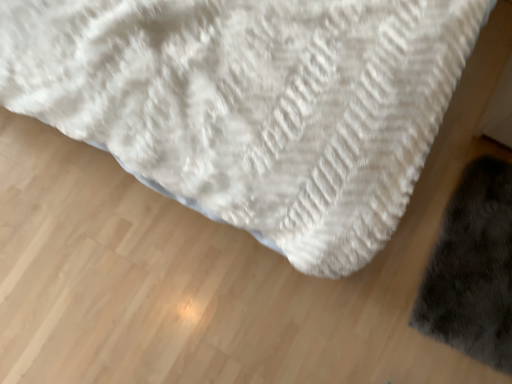
Question: Is dark gray fluffy mat at lower right far from white fluffy towel at center?

Choices:
 (A) no
 (B) yes

Answer: (A)

Question: From the image's perspective, is dark gray fluffy mat at lower right over white fluffy towel at center?

Choices:
 (A) yes
 (B) no

Answer: (B)

Question: Is dark gray fluffy mat at lower right in front of white fluffy towel at center?

Choices:
 (A) yes
 (B) no

Answer: (B)

Question: Is dark gray fluffy mat at lower right smaller than white fluffy towel at center?

Choices:
 (A) no
 (B) yes

Answer: (B)

Question: Does dark gray fluffy mat at lower right contain white fluffy towel at center?

Choices:
 (A) yes
 (B) no

Answer: (B)

Question: Does dark gray fluffy mat at lower right lie behind white fluffy towel at center?

Choices:
 (A) yes
 (B) no

Answer: (A)

Question: Is white fluffy towel at center smaller than dark gray fluffy mat at lower right?

Choices:
 (A) yes
 (B) no

Answer: (B)

Question: From the image's perspective, is white fluffy towel at center under dark gray fluffy mat at lower right?

Choices:
 (A) no
 (B) yes

Answer: (A)

Question: Considering the relative sizes of white fluffy towel at center and dark gray fluffy mat at lower right in the image provided, is white fluffy towel at center bigger than dark gray fluffy mat at lower right?

Choices:
 (A) no
 (B) yes

Answer: (B)

Question: Can you confirm if white fluffy towel at center is shorter than dark gray fluffy mat at lower right?

Choices:
 (A) no
 (B) yes

Answer: (A)

Question: From the image's perspective, is white fluffy towel at center on dark gray fluffy mat at lower right?

Choices:
 (A) no
 (B) yes

Answer: (B)

Question: Is white fluffy towel at center facing away from dark gray fluffy mat at lower right?

Choices:
 (A) no
 (B) yes

Answer: (A)

Question: From their relative heights in the image, would you say white fluffy towel at center is taller or shorter than dark gray fluffy mat at lower right?

Choices:
 (A) tall
 (B) short

Answer: (A)